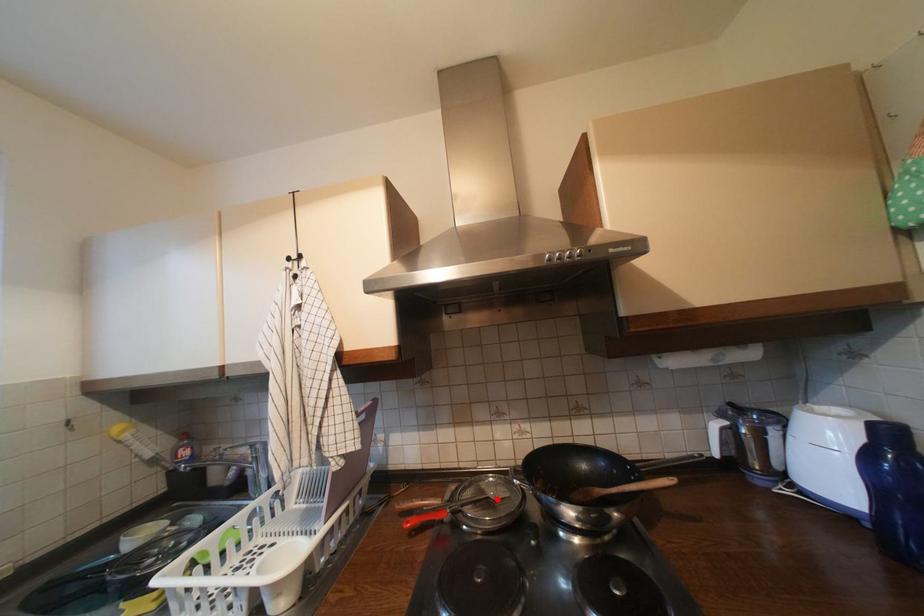
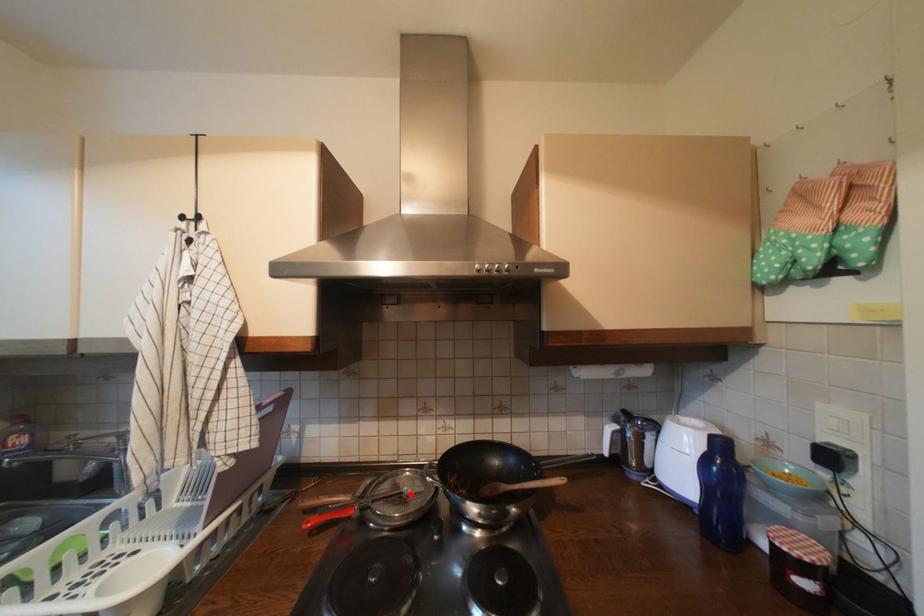
I am providing you with two images of the same scene from different viewpoints. A red point is marked on the first image and another point is marked on the second image. Is the red point in image1 aligned with the point shown in image2?

Yes